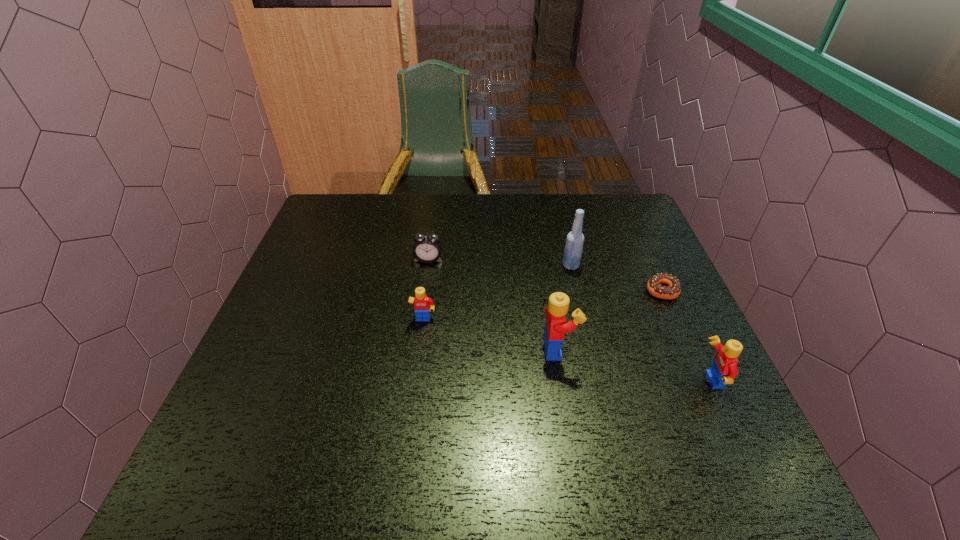
Identify which Lego is the second nearest to the doughnut. Please provide its 2D coordinates. Your answer should be formatted as a tuple, i.e. [(x, y)], where the tuple contains the x and y coordinates of a point satisfying the conditions above.

[(556, 327)]

Where is `vacant position in the image that satisfies the following two spatial constraints: 1. on the front side of the fourth nearest object; 2. on the left side of the alarm clock`? The height and width of the screenshot is (540, 960). vacant position in the image that satisfies the following two spatial constraints: 1. on the front side of the fourth nearest object; 2. on the left side of the alarm clock is located at coordinates (424, 290).